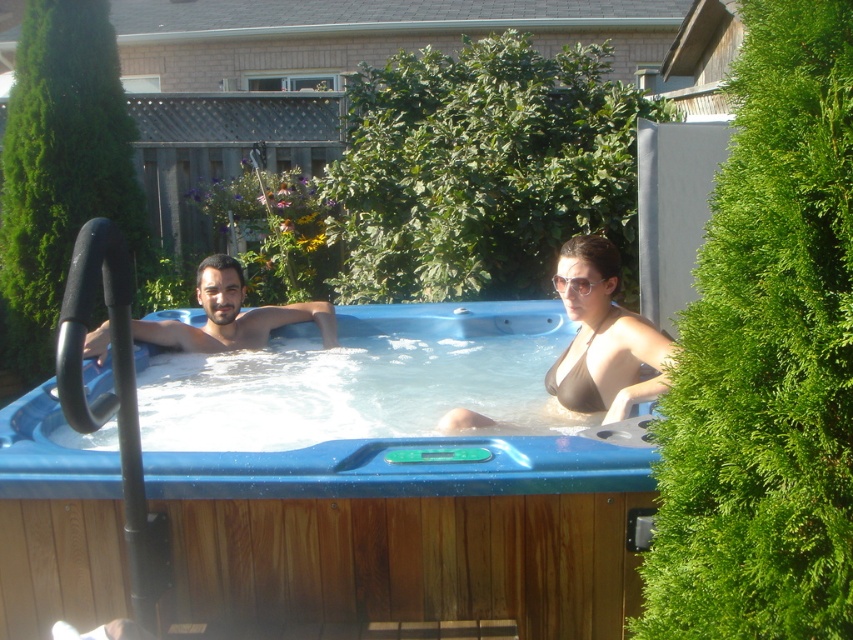
Which of these two, blue wood hot tub at center or matte black man at left, stands shorter?

Standing shorter between the two is matte black man at left.

Measure the distance between blue wood hot tub at center and camera.

The distance of blue wood hot tub at center from camera is 2.25 meters.

Where is `blue wood hot tub at center`? The width and height of the screenshot is (853, 640). blue wood hot tub at center is located at coordinates (408, 532).

Which is below, blue wood hot tub at center or brown bikini top at center?

blue wood hot tub at center is below.

Which of these two, blue wood hot tub at center or brown bikini top at center, stands shorter?

brown bikini top at center is shorter.

Find the location of `blue wood hot tub at center`. blue wood hot tub at center is located at coordinates (408, 532).

Between brown bikini top at center and matte black man at left, which one is positioned higher?

matte black man at left is above.

Can you confirm if brown bikini top at center is taller than matte black man at left?

Yes.

Find the location of a particular element. Image resolution: width=853 pixels, height=640 pixels. brown bikini top at center is located at coordinates (602, 337).